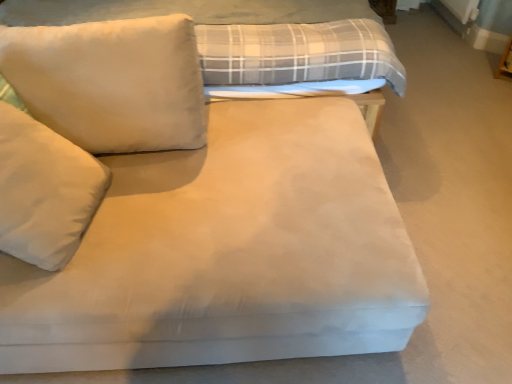
Question: Considering their positions, is white soft pillow at left, the 2th pillow when ordered from top to bottom, located in front of or behind white soft pillow at upper left, marked as the first pillow in a top-to-bottom arrangement?

Choices:
 (A) behind
 (B) front

Answer: (B)

Question: Is white soft pillow at left, the 2th pillow when ordered from top to bottom, to the left or to the right of white soft pillow at upper left, placed as the 2th pillow when sorted from bottom to top, in the image?

Choices:
 (A) right
 (B) left

Answer: (B)

Question: Estimate the real-world distances between objects in this image. Which object is closer to the suede-like beige bed at center?

Choices:
 (A) white soft pillow at left, the first pillow ordered from the bottom
 (B) white soft pillow at upper left, placed as the 2th pillow when sorted from bottom to top

Answer: (B)

Question: Which object is the farthest from the white soft pillow at left, the first pillow ordered from the bottom?

Choices:
 (A) suede-like beige bed at center
 (B) white soft pillow at upper left, placed as the 2th pillow when sorted from bottom to top

Answer: (A)